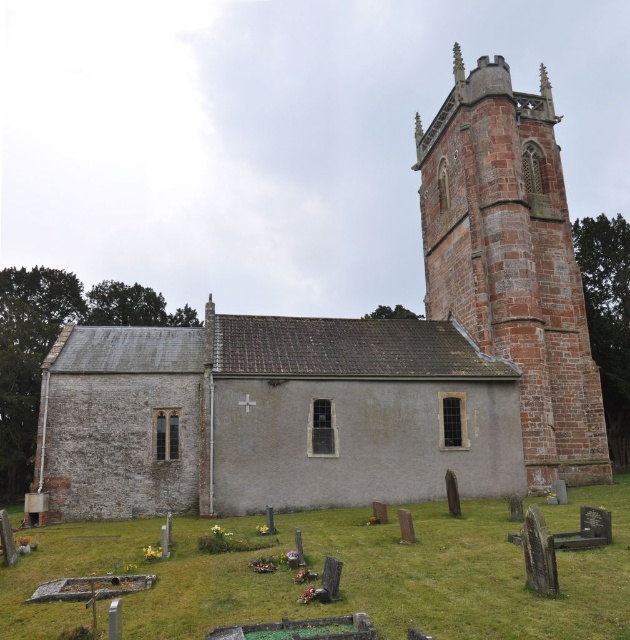
You are standing in a field and see the smooth stone church at center and the rustic stone tower at right. Which structure is closer to you?

The smooth stone church at center is closer to the viewer than the rustic stone tower at right.

Consider the image. You are standing in front of the church and want to take a photo that includes both point (423, 131) and point (558, 218). Which point is closer to your camera?

Point (423, 131) is closer to the camera than point (558, 218) because it is further to the camera.

You are standing at a point 50 meters away from the church. You want to move closer to the church so that you can see the cross on top of the tower clearly. If you move forward by 0.5 meters, will you be closer to the point marked at coordinates point [530,330] than before?

The distance of point [530,330] from camera is 49.49 meters. Moving forward by 0.5 meters would bring you to 49.5 meters away from your original position, which is still 49.49 meters from the point. Therefore, you will be closer to the point marked at coordinates point [530,330] than before.